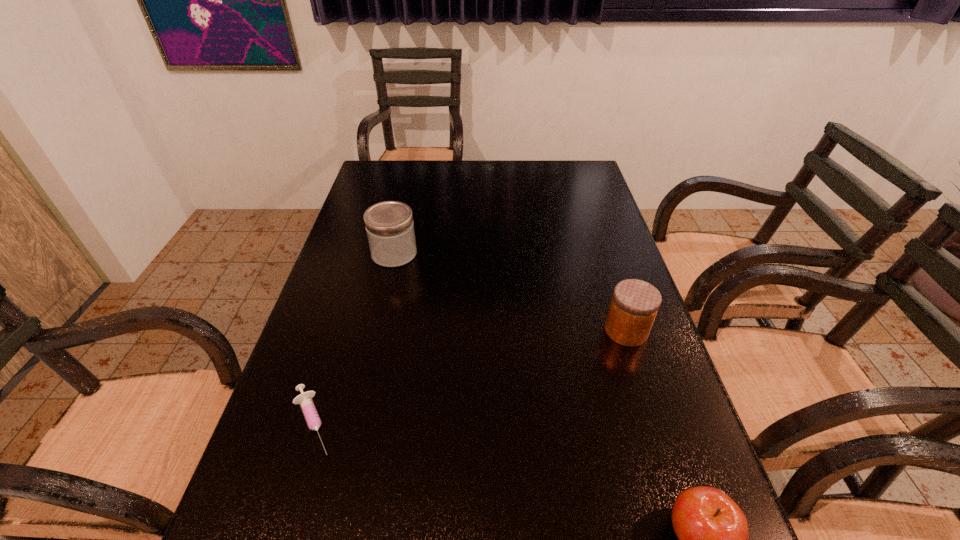
Where is `vacant area that lies between the farthest object and the second nearest object`? vacant area that lies between the farthest object and the second nearest object is located at coordinates (353, 338).

Find the location of a particular element. This screenshot has width=960, height=540. free space that is in between the right jar and the farther jar is located at coordinates tap(510, 292).

You are a GUI agent. You are given a task and a screenshot of the screen. Output one action in this format:
    pyautogui.click(x=<x>, y=<y>)
    Task: Click on the unoccupied area between the farther jar and the second farthest object
    Image resolution: width=960 pixels, height=540 pixels.
    Given the screenshot: What is the action you would take?
    pyautogui.click(x=510, y=292)

Locate an element on the screen. This screenshot has width=960, height=540. empty location between the farther jar and the syringe is located at coordinates (353, 338).

Point out which object is positioned as the nearest to the right jar. Please provide its 2D coordinates. Your answer should be formatted as a tuple, i.e. [(x, y)], where the tuple contains the x and y coordinates of a point satisfying the conditions above.

[(712, 531)]

Image resolution: width=960 pixels, height=540 pixels. Identify the location of object identified as the third closest to the farthest object. (712, 531).